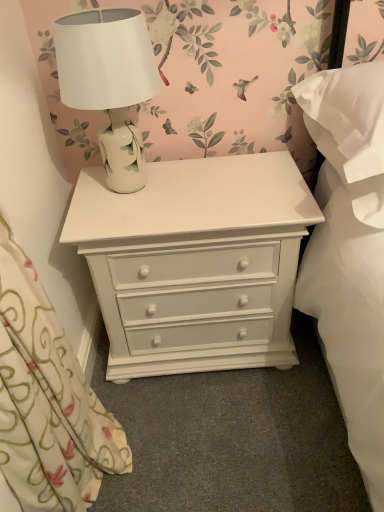
You are a GUI agent. You are given a task and a screenshot of the screen. Output one action in this format:
    pyautogui.click(x=<x>, y=<y>)
    Task: Click on the vacant point to the right of white ceramic lamp at upper center
    This screenshot has height=512, width=384.
    Given the screenshot: What is the action you would take?
    pyautogui.click(x=216, y=181)